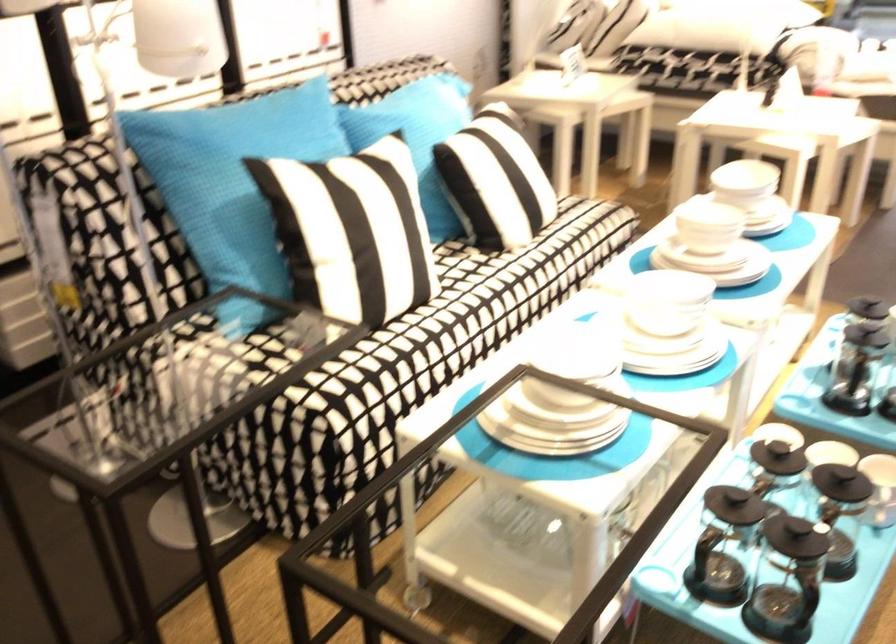
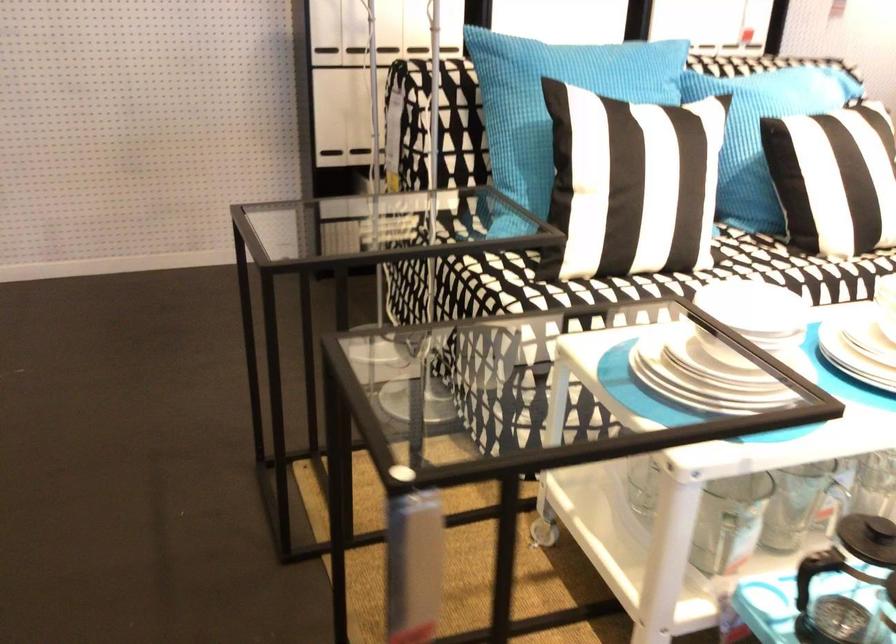
Where in the second image is the point corresponding to point (263, 185) from the first image?

(554, 102)